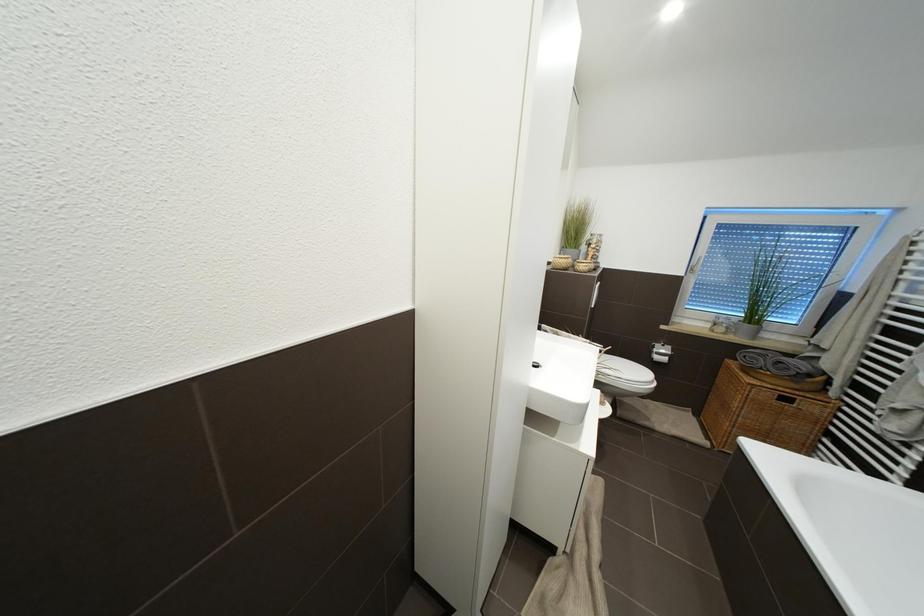
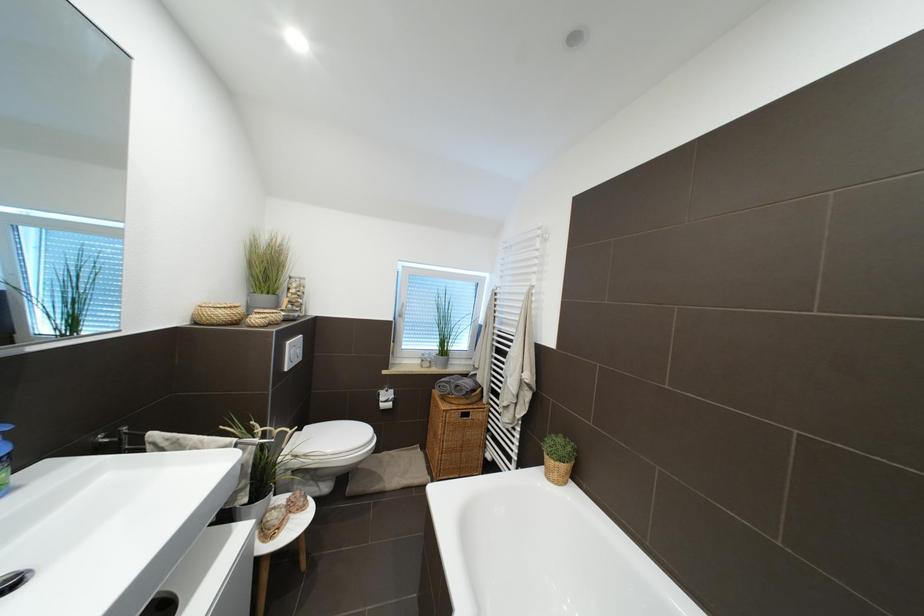
Question: Based on the continuous images, in which direction is the camera rotating? Reply with the corresponding letter.

Choices:
 (A) Left
 (B) Right
 (C) Up
 (D) Down

Answer: (B)